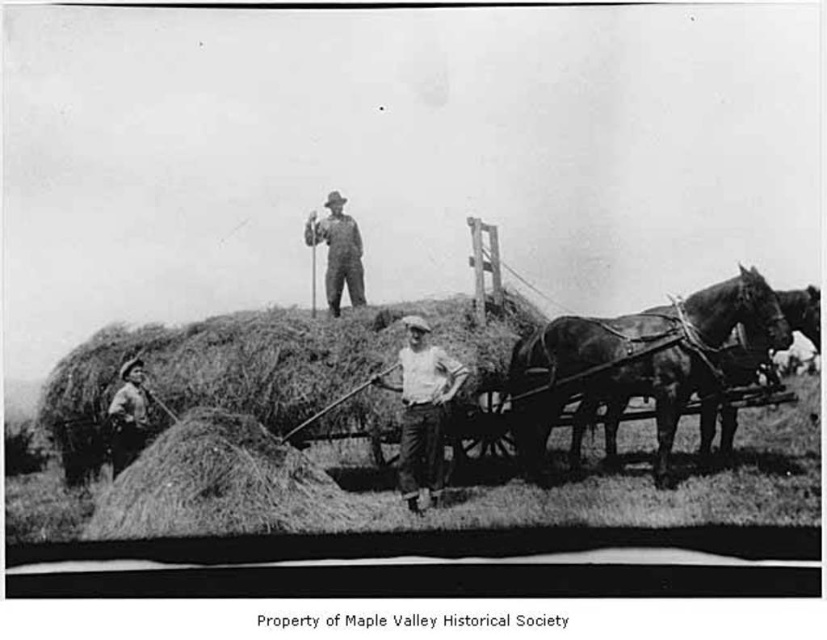
Question: Estimate the real-world distances between objects in this image. Which object is closer to the white cotton shirt at center?

Choices:
 (A) dark brown glossy horse at right
 (B) overalls at center

Answer: (A)

Question: Which of the following is the farthest from the observer?

Choices:
 (A) (338, 296)
 (B) (699, 316)
 (C) (125, 365)
 (D) (424, 468)

Answer: (A)

Question: Is dark brown glossy horse at right above white cotton shirt at center?

Choices:
 (A) yes
 (B) no

Answer: (A)

Question: Is the position of dark brown glossy horse at right more distant than that of white cotton shirt at center?

Choices:
 (A) no
 (B) yes

Answer: (A)

Question: Does dark brown glossy horse at right appear on the left side of overalls at center?

Choices:
 (A) yes
 (B) no

Answer: (B)

Question: Which point is closer to the camera?

Choices:
 (A) rugged brown leather jacket at lower left
 (B) overalls at center

Answer: (A)